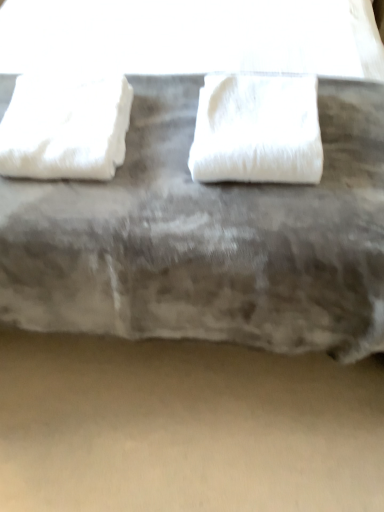
Question: Is the position of beige matte concrete at lower center more distant than that of white fabric at center?

Choices:
 (A) yes
 (B) no

Answer: (A)

Question: Would you consider beige matte concrete at lower center to be distant from white fabric at center?

Choices:
 (A) no
 (B) yes

Answer: (A)

Question: Can you confirm if beige matte concrete at lower center is bigger than white fabric at center?

Choices:
 (A) yes
 (B) no

Answer: (B)

Question: Considering the relative sizes of beige matte concrete at lower center and white fabric at center in the image provided, is beige matte concrete at lower center shorter than white fabric at center?

Choices:
 (A) yes
 (B) no

Answer: (A)

Question: From a real-world perspective, does beige matte concrete at lower center sit lower than white fabric at center?

Choices:
 (A) no
 (B) yes

Answer: (B)

Question: Considering the positions of white fabric at center and white fluffy towel at left, which ranks as the 2th towel in right-to-left order, in the image, is white fabric at center taller or shorter than white fluffy towel at left, which ranks as the 2th towel in right-to-left order,?

Choices:
 (A) tall
 (B) short

Answer: (A)

Question: From a real-world perspective, relative to white fluffy towel at left, the first towel positioned from the left, is white fabric at center vertically above or below?

Choices:
 (A) below
 (B) above

Answer: (B)

Question: In terms of width, does white fabric at center look wider or thinner when compared to white fluffy towel at left, the first towel positioned from the left?

Choices:
 (A) thin
 (B) wide

Answer: (B)

Question: Is white fabric at center bigger or smaller than white fluffy towel at left, the first towel positioned from the left?

Choices:
 (A) big
 (B) small

Answer: (A)

Question: Would you say white fluffy towel at center, acting as the second towel starting from the left, is to the left or to the right of white fluffy towel at left, which ranks as the 2th towel in right-to-left order, in the picture?

Choices:
 (A) right
 (B) left

Answer: (A)

Question: Is white fluffy towel at center, acting as the second towel starting from the left, spatially inside white fluffy towel at left, which ranks as the 2th towel in right-to-left order, or outside of it?

Choices:
 (A) outside
 (B) inside

Answer: (A)

Question: From the image's perspective, is white fluffy towel at center, acting as the second towel starting from the left, above or below white fluffy towel at left, the first towel positioned from the left?

Choices:
 (A) below
 (B) above

Answer: (A)

Question: Is point (243, 157) closer or farther from the camera than point (91, 106)?

Choices:
 (A) farther
 (B) closer

Answer: (B)

Question: Considering their positions, is white fluffy towel at left, the first towel positioned from the left, located in front of or behind white fluffy towel at center, acting as the second towel starting from the left?

Choices:
 (A) front
 (B) behind

Answer: (B)

Question: From a real-world perspective, is white fluffy towel at left, the first towel positioned from the left, positioned above or below white fluffy towel at center, the 1th towel from the right?

Choices:
 (A) above
 (B) below

Answer: (B)